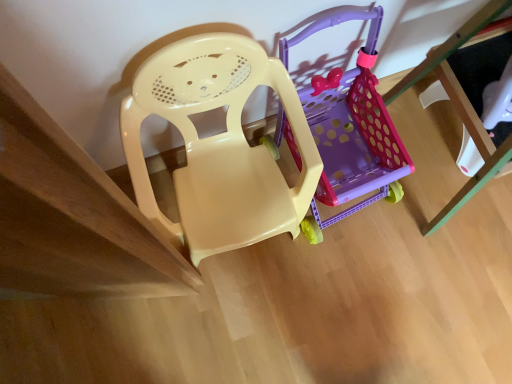
Question: Would you say translucent purple plastic shopping cart at center is a long distance from matte plastic chair at center?

Choices:
 (A) no
 (B) yes

Answer: (A)

Question: Is translucent purple plastic shopping cart at center looking in the opposite direction of matte plastic chair at center?

Choices:
 (A) no
 (B) yes

Answer: (A)

Question: From the image's perspective, is translucent purple plastic shopping cart at center on top of matte plastic chair at center?

Choices:
 (A) no
 (B) yes

Answer: (B)

Question: Can you confirm if translucent purple plastic shopping cart at center is taller than matte plastic chair at center?

Choices:
 (A) yes
 (B) no

Answer: (B)

Question: Is translucent purple plastic shopping cart at center behind matte plastic chair at center?

Choices:
 (A) no
 (B) yes

Answer: (B)

Question: From a real-world perspective, is translucent purple plastic shopping cart at center physically below matte plastic chair at center?

Choices:
 (A) yes
 (B) no

Answer: (A)

Question: From a real-world perspective, is matte plastic chair at center over translucent purple plastic shopping cart at center?

Choices:
 (A) yes
 (B) no

Answer: (A)

Question: Is matte plastic chair at center located outside translucent purple plastic shopping cart at center?

Choices:
 (A) no
 (B) yes

Answer: (B)

Question: From the image's perspective, is matte plastic chair at center over translucent purple plastic shopping cart at center?

Choices:
 (A) no
 (B) yes

Answer: (A)

Question: From the image's perspective, is matte plastic chair at center beneath translucent purple plastic shopping cart at center?

Choices:
 (A) yes
 (B) no

Answer: (A)

Question: Is matte plastic chair at center in contact with translucent purple plastic shopping cart at center?

Choices:
 (A) no
 (B) yes

Answer: (A)

Question: Does matte plastic chair at center have a larger size compared to translucent purple plastic shopping cart at center?

Choices:
 (A) yes
 (B) no

Answer: (A)

Question: From the image's perspective, is matte plastic chair at center positioned above or below translucent purple plastic shopping cart at center?

Choices:
 (A) below
 (B) above

Answer: (A)